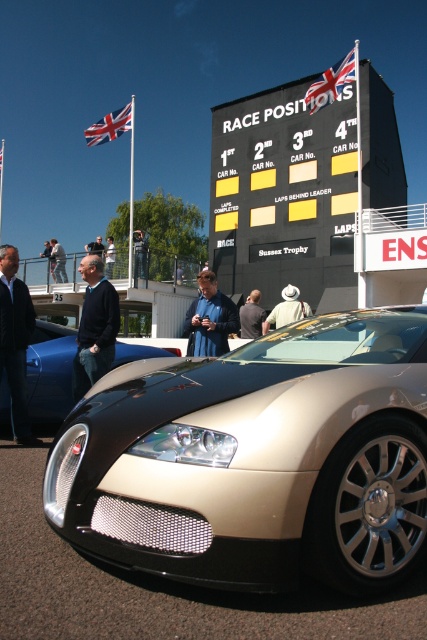
Can you confirm if shiny blue car at center is wider than dark blue jacket at center?

Yes, shiny blue car at center is wider than dark blue jacket at center.

Can you confirm if shiny blue car at center is bigger than dark blue jacket at center?

Yes, shiny blue car at center is bigger than dark blue jacket at center.

Who is more forward, (69,374) or (207,314)?

Point (69,374) is more forward.

Locate an element on the screen. This screenshot has width=427, height=640. shiny blue car at center is located at coordinates (49, 371).

Is dark blue sweater at center wider than dark blue jacket at center?

Yes, dark blue sweater at center is wider than dark blue jacket at center.

Between point (84, 352) and point (222, 308), which one is positioned behind?

Point (222, 308)

Image resolution: width=427 pixels, height=640 pixels. I want to click on dark blue sweater at center, so click(x=94, y=326).

Who is positioned more to the right, black/yellow scoreboard at center or shiny blue car at center?

black/yellow scoreboard at center is more to the right.

Is black/yellow scoreboard at center bigger than shiny blue car at center?

Correct, black/yellow scoreboard at center is larger in size than shiny blue car at center.

Is point (363, 125) less distant than point (43, 352)?

That is False.

Identify the location of black/yellow scoreboard at center. (284, 195).